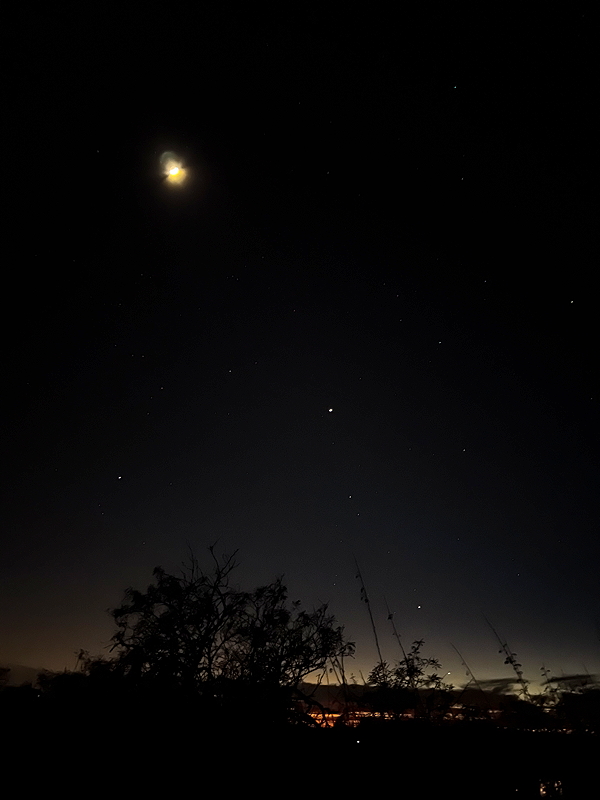
Where is `skylight`? Image resolution: width=600 pixels, height=800 pixels. skylight is located at coordinates (359, 674), (459, 681), (536, 689).